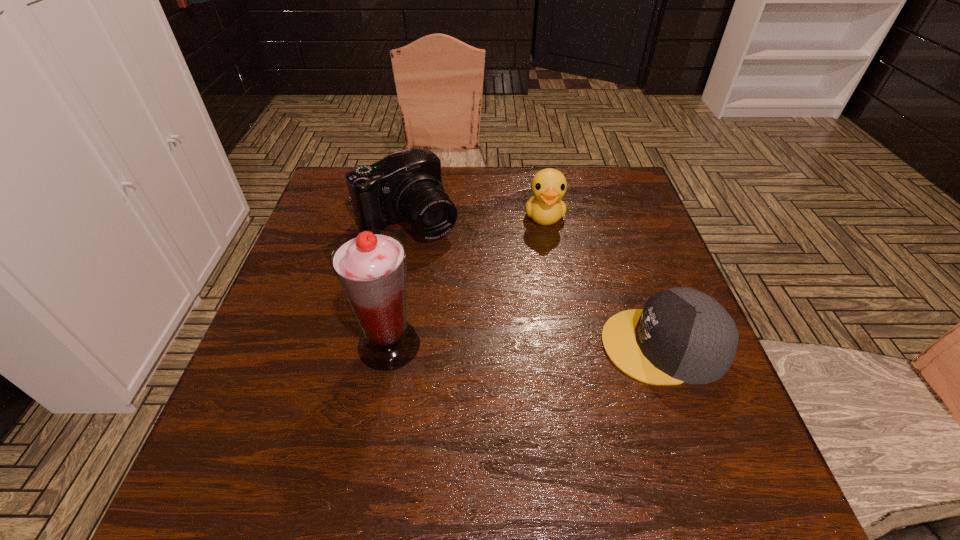
The height and width of the screenshot is (540, 960). In order to click on the tallest object in this screenshot , I will do `click(370, 266)`.

At what (x,y) coordinates should I click in order to perform the action: click on cap. Please return your answer as a coordinate pair (x, y). The image size is (960, 540). Looking at the image, I should click on (682, 335).

Find the location of a particular element. The width and height of the screenshot is (960, 540). the shortest object is located at coordinates (682, 335).

Find the location of `camera`. camera is located at coordinates (406, 185).

You are a GUI agent. You are given a task and a screenshot of the screen. Output one action in this format:
    pyautogui.click(x=<x>, y=<y>)
    Task: Click on the second object from right to left
    The image size is (960, 540).
    Given the screenshot: What is the action you would take?
    pyautogui.click(x=548, y=186)

Identify the location of vacant space located on the back of the tallest object. This screenshot has width=960, height=540. (409, 232).

Locate an element on the screen. vacant space located on the front-facing side of the cap is located at coordinates (486, 345).

At what (x,y) coordinates should I click in order to perform the action: click on free space located 0.260m on the front-facing side of the cap. Please return your answer as a coordinate pair (x, y). The width and height of the screenshot is (960, 540). Looking at the image, I should click on (476, 345).

Identify the location of free space located on the front-facing side of the cap. (x=432, y=345).

Find the location of a particular element. vacant space located on the lens of the camera is located at coordinates (468, 292).